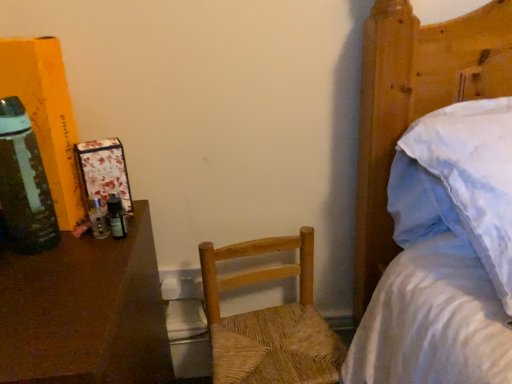
Question: From the image's perspective, is woven wood chair at center under green glass bottle at left?

Choices:
 (A) no
 (B) yes

Answer: (B)

Question: From the image's perspective, does woven wood chair at center appear higher than green glass bottle at left?

Choices:
 (A) no
 (B) yes

Answer: (A)

Question: Would you consider woven wood chair at center to be distant from green glass bottle at left?

Choices:
 (A) no
 (B) yes

Answer: (A)

Question: From a real-world perspective, is woven wood chair at center on top of green glass bottle at left?

Choices:
 (A) yes
 (B) no

Answer: (B)

Question: Is woven wood chair at center in front of green glass bottle at left?

Choices:
 (A) yes
 (B) no

Answer: (B)

Question: From a real-world perspective, is woven wood chair at center positioned under green glass bottle at left based on gravity?

Choices:
 (A) yes
 (B) no

Answer: (A)

Question: Does white cotton bed at upper right have a larger size compared to brown polished wood desk at left?

Choices:
 (A) no
 (B) yes

Answer: (B)

Question: Does white cotton bed at upper right have a lesser height compared to brown polished wood desk at left?

Choices:
 (A) no
 (B) yes

Answer: (A)

Question: Considering the relative sizes of white cotton bed at upper right and brown polished wood desk at left in the image provided, is white cotton bed at upper right wider than brown polished wood desk at left?

Choices:
 (A) yes
 (B) no

Answer: (B)

Question: Is white cotton bed at upper right facing towards brown polished wood desk at left?

Choices:
 (A) yes
 (B) no

Answer: (B)

Question: Does white cotton bed at upper right appear on the right side of brown polished wood desk at left?

Choices:
 (A) no
 (B) yes

Answer: (B)

Question: Considering the relative positions of white cotton bed at upper right and brown polished wood desk at left in the image provided, is white cotton bed at upper right behind brown polished wood desk at left?

Choices:
 (A) no
 (B) yes

Answer: (A)

Question: Is brown polished wood desk at left surrounding woven wood chair at center?

Choices:
 (A) no
 (B) yes

Answer: (A)